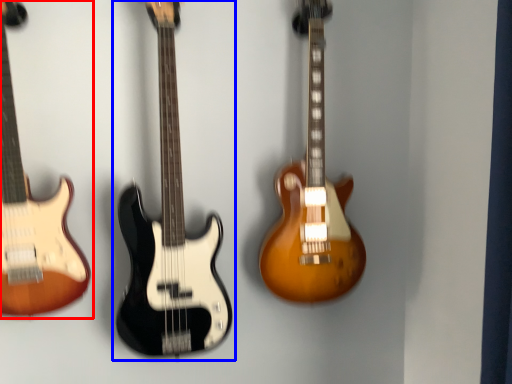
Question: Which of the following is the closest to the observer, guitar (highlighted by a red box) or guitar (highlighted by a blue box)?

Choices:
 (A) guitar
 (B) guitar

Answer: (A)